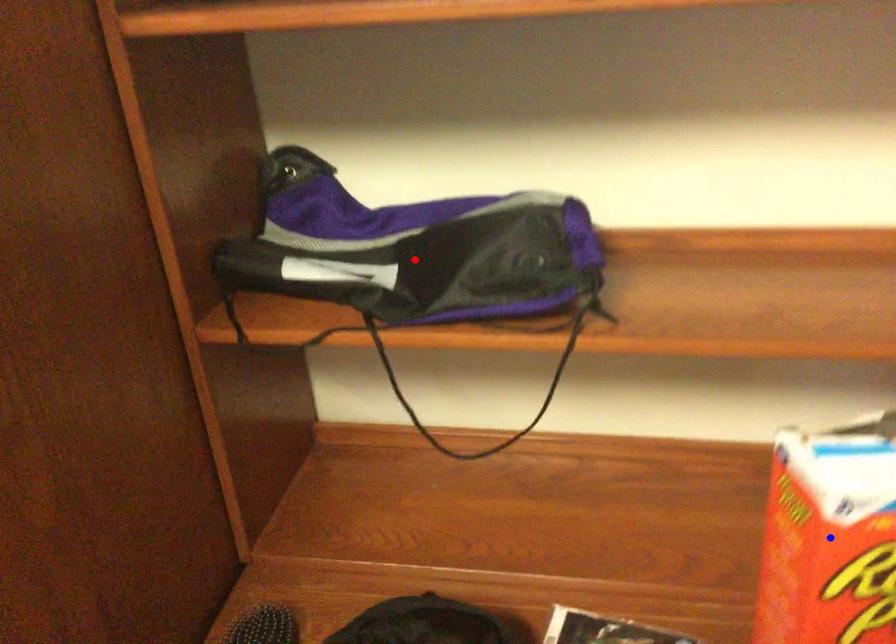
Question: In the image, two points are highlighted. Which point is nearer to the camera? Reply with the corresponding letter.

Choices:
 (A) blue point
 (B) red point

Answer: (A)